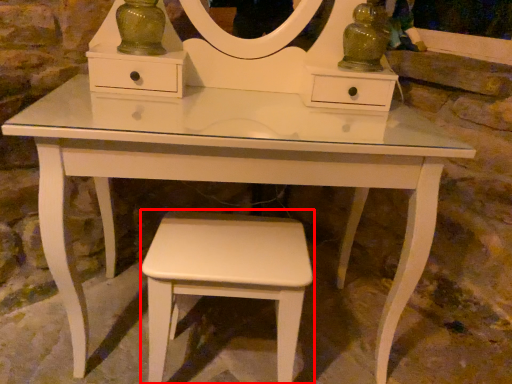
Question: From the image's perspective, where is stool (annotated by the red box) located relative to glass vase?

Choices:
 (A) above
 (B) below

Answer: (B)